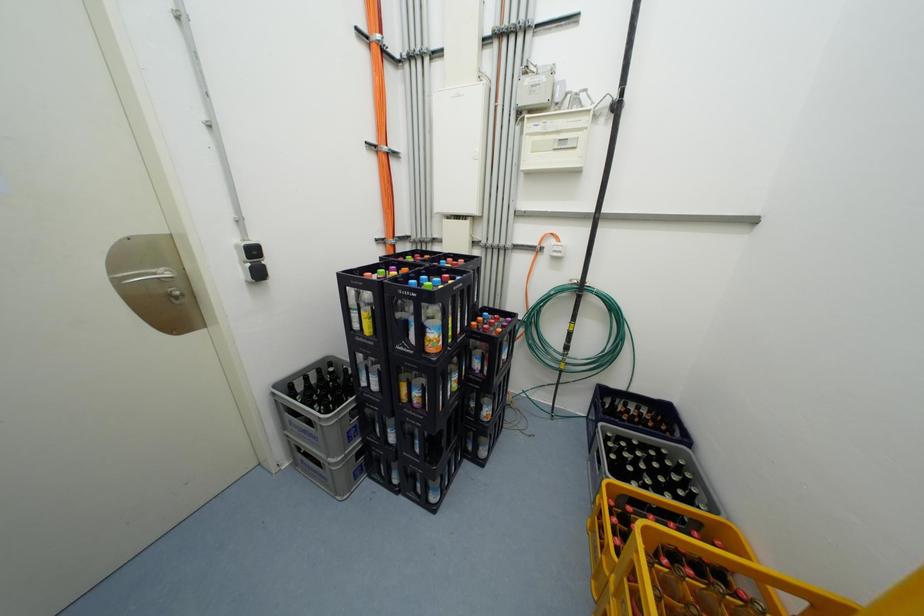
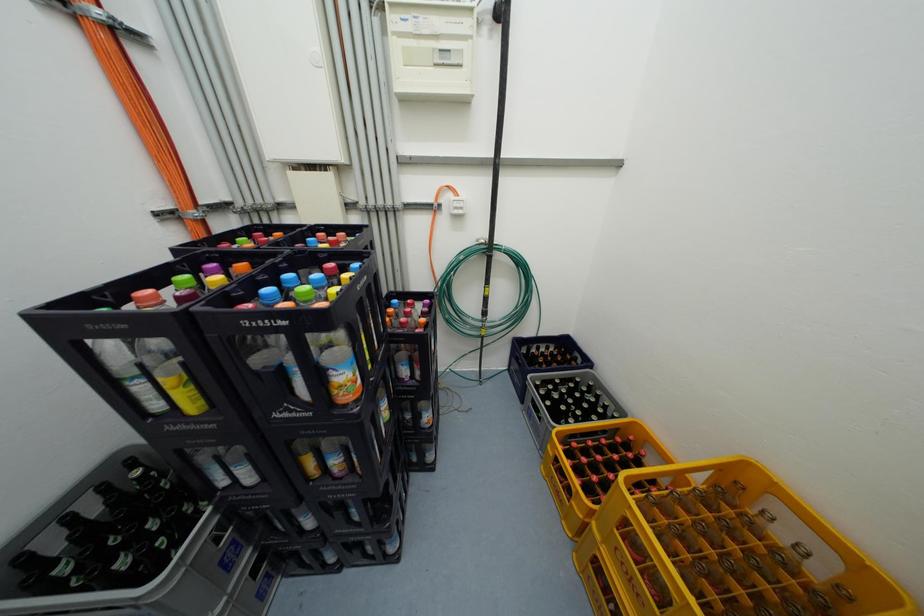
Question: The images are taken continuously from a first-person perspective. In which direction is your viewpoint rotating?

Choices:
 (A) Left
 (B) Right
 (C) Up
 (D) Down

Answer: (B)